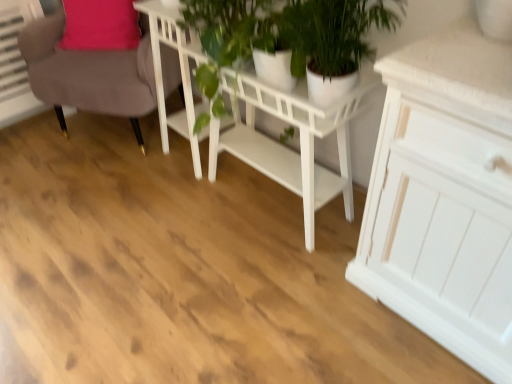
You are a GUI agent. You are given a task and a screenshot of the screen. Output one action in this format:
    pyautogui.click(x=<x>, y=<y>)
    Task: Click on the vacant area situated to the left side of white glossy table at center, which is counted as the first table, starting from the right
    The height and width of the screenshot is (384, 512).
    Given the screenshot: What is the action you would take?
    pyautogui.click(x=166, y=220)